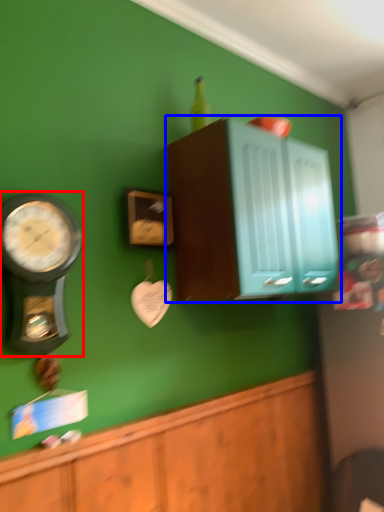
Question: Which object appears farthest to the camera in this image, wall clock (highlighted by a red box) or cabinetry (highlighted by a blue box)?

Choices:
 (A) wall clock
 (B) cabinetry

Answer: (B)